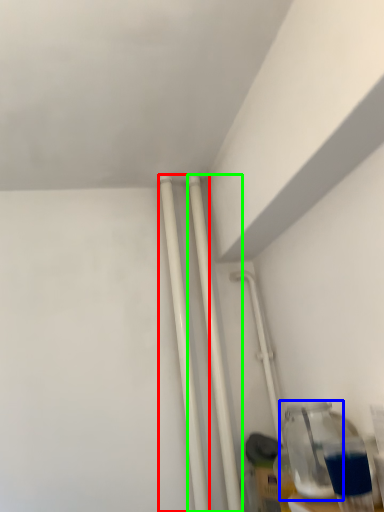
Question: Considering the real-world distances, which object is farthest from pipe (highlighted by a red box)? bottle (highlighted by a blue box) or pipe (highlighted by a green box)?

Choices:
 (A) bottle
 (B) pipe

Answer: (A)